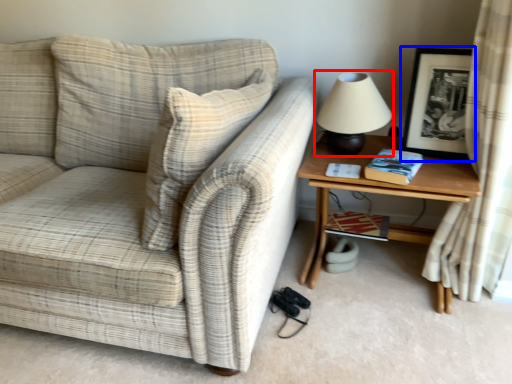
Question: Which point is closer to the camera, table lamp (highlighted by a red box) or picture frame (highlighted by a blue box)?

Choices:
 (A) table lamp
 (B) picture frame

Answer: (B)